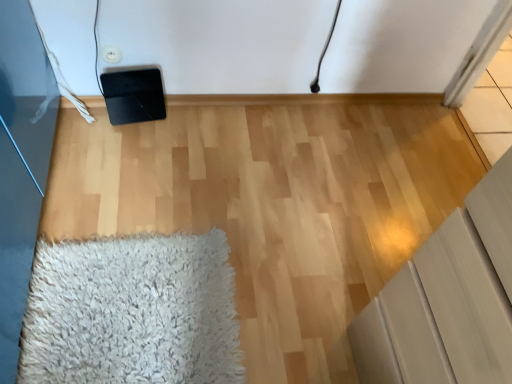
Question: Would you say matte gray cabinet at lower right is a long distance from white shaggy rug at lower left?

Choices:
 (A) yes
 (B) no

Answer: (B)

Question: From a real-world perspective, is matte gray cabinet at lower right on top of white shaggy rug at lower left?

Choices:
 (A) no
 (B) yes

Answer: (B)

Question: From a real-world perspective, is matte gray cabinet at lower right positioned under white shaggy rug at lower left based on gravity?

Choices:
 (A) yes
 (B) no

Answer: (B)

Question: Is matte gray cabinet at lower right not within white shaggy rug at lower left?

Choices:
 (A) yes
 (B) no

Answer: (A)

Question: Is matte gray cabinet at lower right at the left side of white shaggy rug at lower left?

Choices:
 (A) no
 (B) yes

Answer: (A)

Question: Is matte gray cabinet at lower right taller than white shaggy rug at lower left?

Choices:
 (A) no
 (B) yes

Answer: (B)

Question: From a real-world perspective, is white shaggy rug at lower left under matte gray cabinet at lower right?

Choices:
 (A) no
 (B) yes

Answer: (B)

Question: Is white shaggy rug at lower left looking in the opposite direction of matte gray cabinet at lower right?

Choices:
 (A) no
 (B) yes

Answer: (A)

Question: Does white shaggy rug at lower left have a greater width compared to matte gray cabinet at lower right?

Choices:
 (A) yes
 (B) no

Answer: (A)

Question: From the image's perspective, does white shaggy rug at lower left appear lower than matte gray cabinet at lower right?

Choices:
 (A) no
 (B) yes

Answer: (B)

Question: Is white shaggy rug at lower left positioned before matte gray cabinet at lower right?

Choices:
 (A) yes
 (B) no

Answer: (B)

Question: Is white shaggy rug at lower left further to camera compared to matte gray cabinet at lower right?

Choices:
 (A) yes
 (B) no

Answer: (A)

Question: Considering the positions of point (177, 286) and point (428, 292), is point (177, 286) closer or farther from the camera than point (428, 292)?

Choices:
 (A) farther
 (B) closer

Answer: (A)